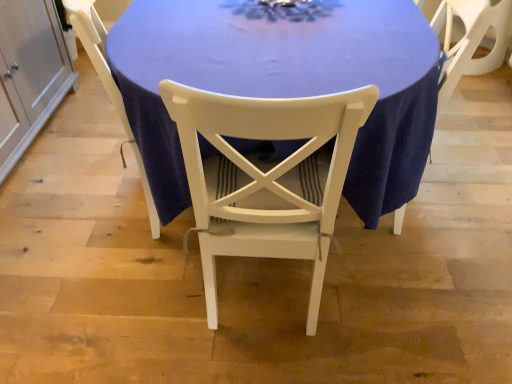
Question: Is white wood chair at center, marked as the 1th chair in a left-to-right arrangement, in front of or behind white wood cabinet at left in the image?

Choices:
 (A) front
 (B) behind

Answer: (A)

Question: Considering the positions of white wood chair at center, marked as the 1th chair in a left-to-right arrangement, and white wood cabinet at left in the image, is white wood chair at center, marked as the 1th chair in a left-to-right arrangement, taller or shorter than white wood cabinet at left?

Choices:
 (A) short
 (B) tall

Answer: (B)

Question: Estimate the real-world distances between objects in this image. Which object is farther from the blue fabric table at center?

Choices:
 (A) white wood chair at center, which ranks as the third chair in right-to-left order
 (B) white wood cabinet at left
 (C) white painted wood chair at center, arranged as the 2th chair when viewed from the right
 (D) white wood chair at center, marked as the 3th chair in a left-to-right arrangement

Answer: (B)

Question: Based on their relative distances, which object is nearer to the white wood cabinet at left?

Choices:
 (A) blue fabric table at center
 (B) white wood chair at center, marked as the 1th chair in a left-to-right arrangement
 (C) white painted wood chair at center, marked as the 2th chair in a left-to-right arrangement
 (D) white wood chair at center, marked as the 3th chair in a left-to-right arrangement

Answer: (B)